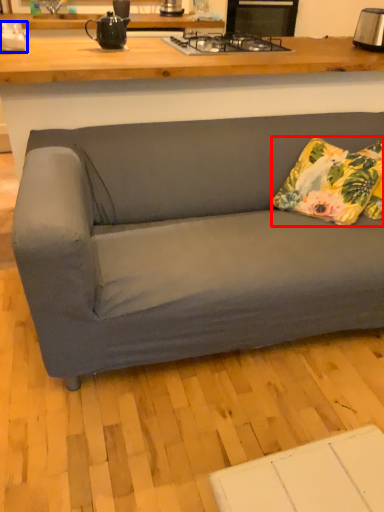
Question: Which of the following is the closest to the observer, pillow (highlighted by a red box) or appliance (highlighted by a blue box)?

Choices:
 (A) pillow
 (B) appliance

Answer: (A)